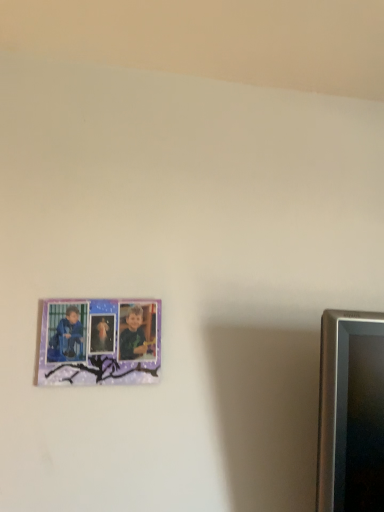
Locate an element on the screen. This screenshot has height=512, width=384. purple glossy photo frame at lower left is located at coordinates tap(100, 341).

In order to face purple glossy photo frame at lower left, should I rotate leftwards or rightwards?

A 12.251 degree turn to the left will do.

What do you see at coordinates (100, 341) in the screenshot? The height and width of the screenshot is (512, 384). I see `purple glossy photo frame at lower left` at bounding box center [100, 341].

Where is `purple glossy photo frame at lower left`? Image resolution: width=384 pixels, height=512 pixels. purple glossy photo frame at lower left is located at coordinates (100, 341).